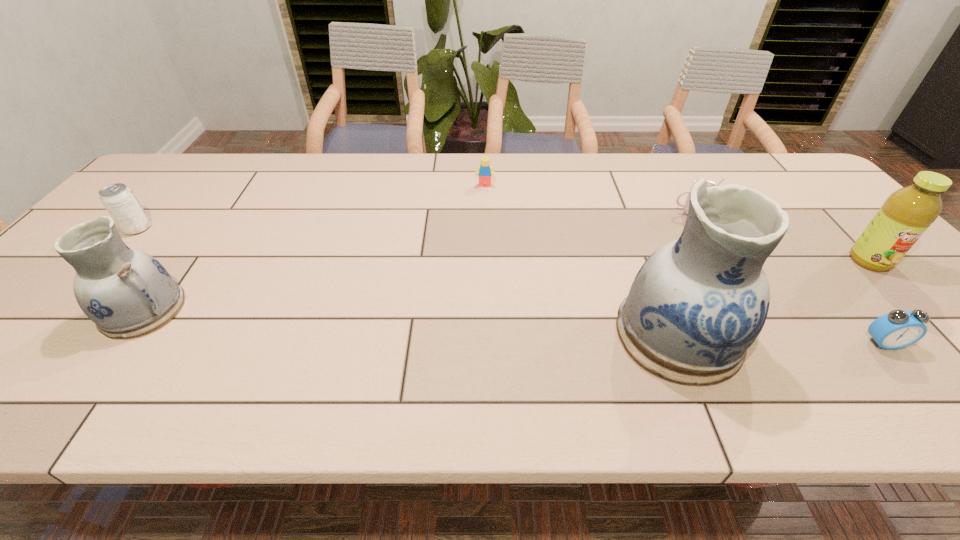
Where is `alarm clock`? alarm clock is located at coordinates (897, 329).

Where is `vacant region located on the right of the left pottery`? vacant region located on the right of the left pottery is located at coordinates (355, 309).

At what (x,y) coordinates should I click in order to perform the action: click on vacant space situated on the left of the right pottery. Please return your answer as a coordinate pair (x, y). This screenshot has width=960, height=540. Looking at the image, I should click on (565, 334).

At what (x,y) coordinates should I click in order to perform the action: click on vacant area situated on the front-facing side of the Lego. Please return your answer as a coordinate pair (x, y). The image size is (960, 540). Looking at the image, I should click on (x=486, y=280).

Where is `vacant area situated 0.330m on the right of the soda can`? The height and width of the screenshot is (540, 960). vacant area situated 0.330m on the right of the soda can is located at coordinates click(x=271, y=228).

At what (x,y) coordinates should I click in order to perform the action: click on free space located on the side with the handle of the cup. Please return your answer as a coordinate pair (x, y). This screenshot has height=540, width=960. Looking at the image, I should click on (574, 213).

At what (x,y) coordinates should I click in order to perform the action: click on vacant point located on the side with the handle of the cup. Please return your answer as a coordinate pair (x, y). Looking at the image, I should click on tap(536, 213).

You are a GUI agent. You are given a task and a screenshot of the screen. Output one action in this format:
    pyautogui.click(x=<x>, y=<y>)
    Task: Click on the vacant position located 0.200m on the side with the handle of the cup
    
    Given the screenshot: What is the action you would take?
    pyautogui.click(x=602, y=213)

Locate an element on the screen. This screenshot has height=540, width=960. vacant space positioned on the front label of the rightmost object is located at coordinates (914, 307).

The image size is (960, 540). Identify the location of object present at the far edge. (484, 171).